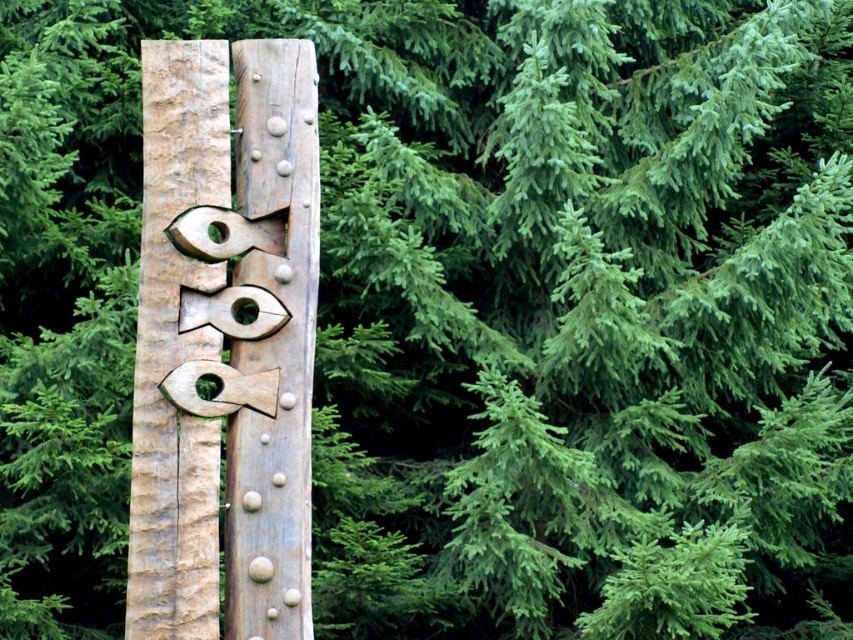
Question: Can you confirm if natural wood totem pole at center is positioned to the left of wooden totem pole at center?

Choices:
 (A) yes
 (B) no

Answer: (A)

Question: Considering the relative positions of natural wood totem pole at center and wooden totem pole at center in the image provided, where is natural wood totem pole at center located with respect to wooden totem pole at center?

Choices:
 (A) below
 (B) above

Answer: (A)

Question: Can you confirm if natural wood totem pole at center is wider than wooden totem pole at center?

Choices:
 (A) yes
 (B) no

Answer: (A)